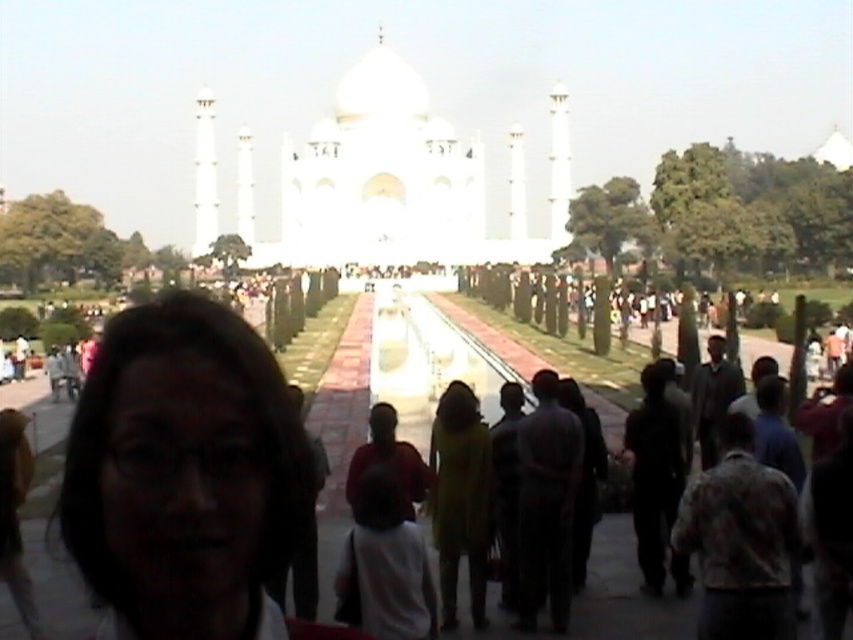
You are a tourist standing on the pathway leading to the Taj Mahal. You notice a person with matte black hair at lower left and the white marble palace at center. Which object is positioned lower in the image?

The matte black hair at lower left is located below the white marble palace at center, so it is positioned lower in the image.

You are a tourist standing on the pathway leading to the Taj Mahal. You notice a person with matte black hair at lower left and the white marble palace at center. Which object is positioned to the left of the other?

The matte black hair at lower left is to the left of the white marble palace at center.

You are standing at the lower left corner of the Taj Mahal complex and notice a person with matte black hair at lower left and the white marble palace at center. If you want to reach the palace quickly, should you walk directly towards it or take a detour around the hedges?

The matte black hair at lower left is 328.63 feet away from the white marble palace at center. Since the pathway is paved and lined with hedges, walking directly towards the white marble palace at center would be the shortest and most efficient route.